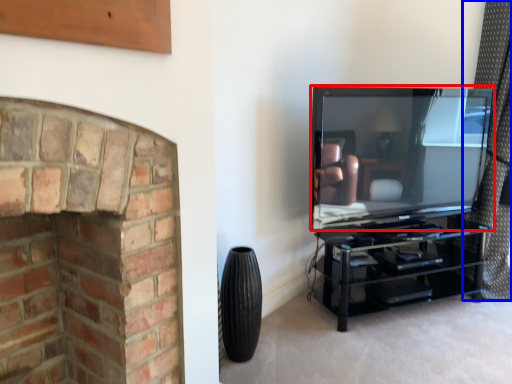
Question: Which object appears closest to the camera in this image, television (highlighted by a red box) or curtain (highlighted by a blue box)?

Choices:
 (A) television
 (B) curtain

Answer: (A)